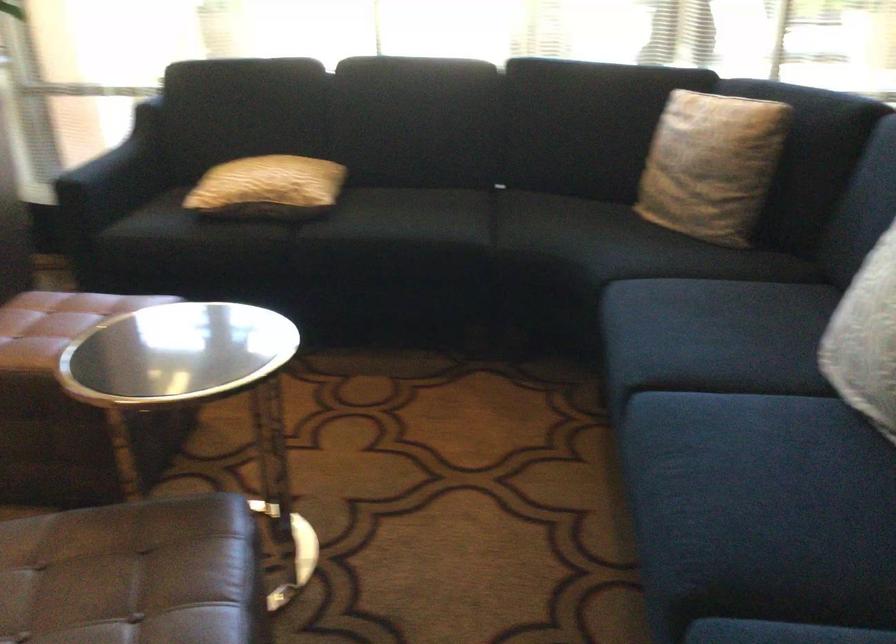
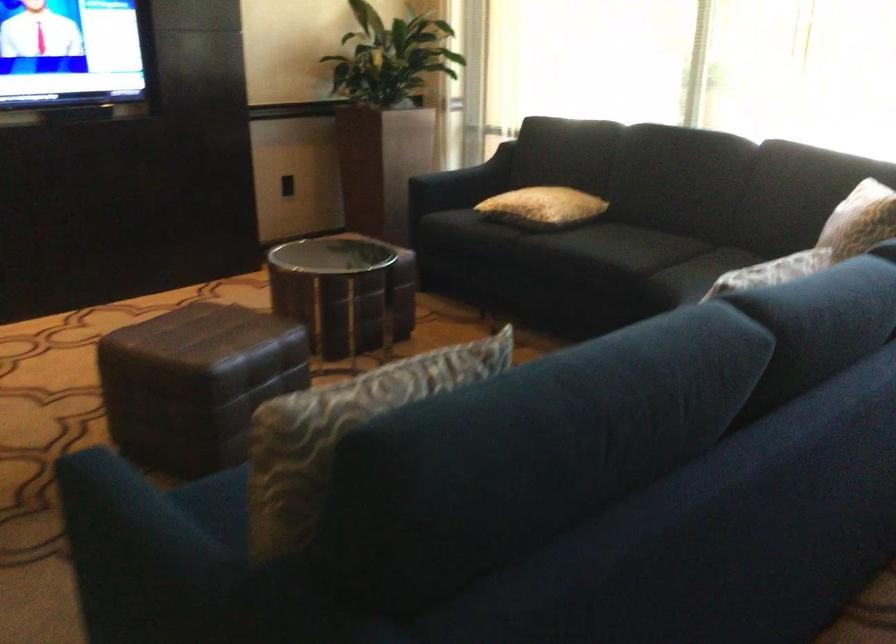
Question: I am providing you with two images of the same scene from different viewpoints. Please identify which objects are invisible in image2.

Choices:
 (A) light colored pillow
 (B) rack wheel
 (C) yellow patterned pillow
 (D) sofa sitting surface

Answer: (A)